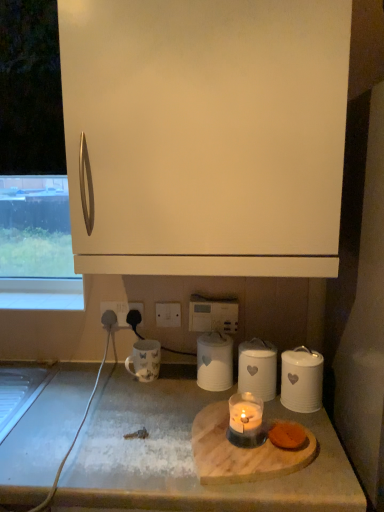
Where is `free spot in front of white matte canister at lower right, which ranks as the third kitchen appliance in left-to-right order`? Image resolution: width=384 pixels, height=512 pixels. free spot in front of white matte canister at lower right, which ranks as the third kitchen appliance in left-to-right order is located at coordinates (317, 435).